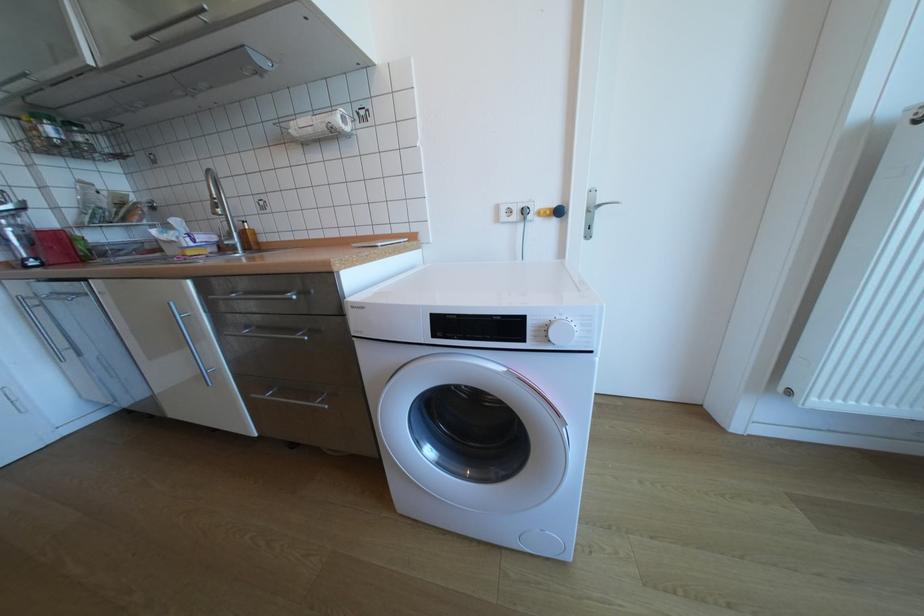
Locate an element on the screen. The image size is (924, 616). vertical cabinet handle is located at coordinates (189, 342).